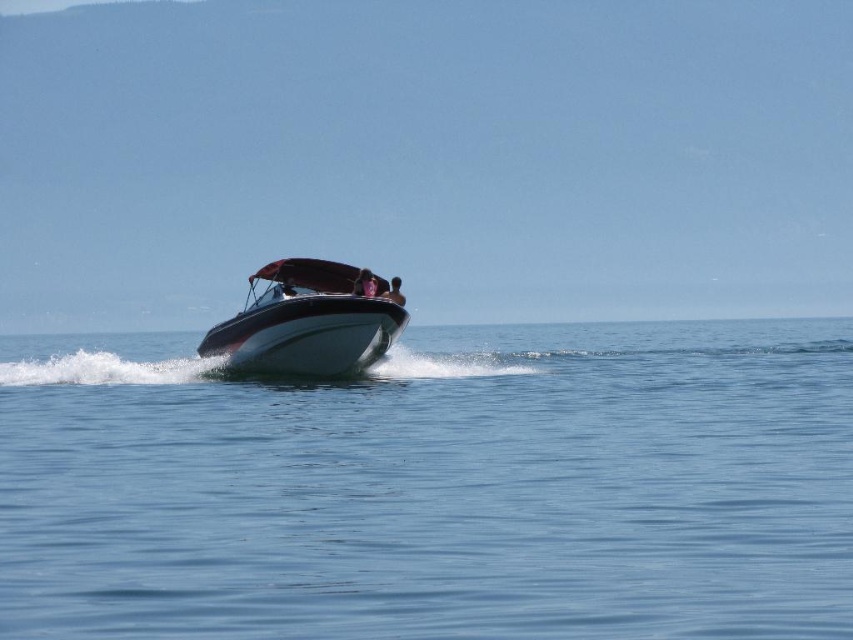
Does smooth leather jacket at center appear on the left side of smooth skin face at center?

Indeed, smooth leather jacket at center is positioned on the left side of smooth skin face at center.

Does smooth leather jacket at center appear on the right side of smooth skin face at center?

In fact, smooth leather jacket at center is to the left of smooth skin face at center.

What do you see at coordinates (364, 284) in the screenshot? The width and height of the screenshot is (853, 640). I see `smooth leather jacket at center` at bounding box center [364, 284].

Where is `smooth leather jacket at center`? The width and height of the screenshot is (853, 640). smooth leather jacket at center is located at coordinates (364, 284).

Describe the element at coordinates (434, 486) in the screenshot. Image resolution: width=853 pixels, height=640 pixels. I see `blue smooth water at center` at that location.

This screenshot has width=853, height=640. What do you see at coordinates (434, 486) in the screenshot? I see `blue smooth water at center` at bounding box center [434, 486].

Locate an element on the screen. The width and height of the screenshot is (853, 640). blue smooth water at center is located at coordinates (434, 486).

Is blue smooth water at center taller than smooth skin face at center?

Indeed, blue smooth water at center has a greater height compared to smooth skin face at center.

Does blue smooth water at center come in front of smooth skin face at center?

That is True.

Is point (166, 544) closer to viewer compared to point (393, 276)?

Yes, it is.

I want to click on blue smooth water at center, so click(434, 486).